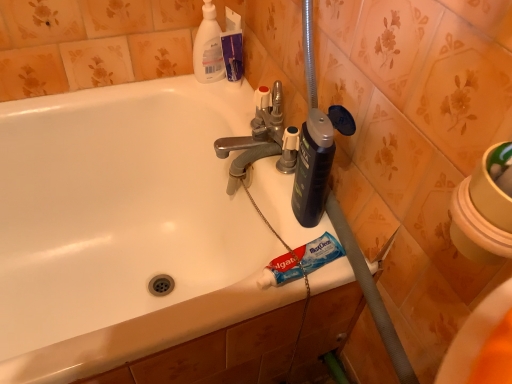
Identify the location of free space behind blue matte toothpaste at lower center. This screenshot has height=384, width=512. (284, 204).